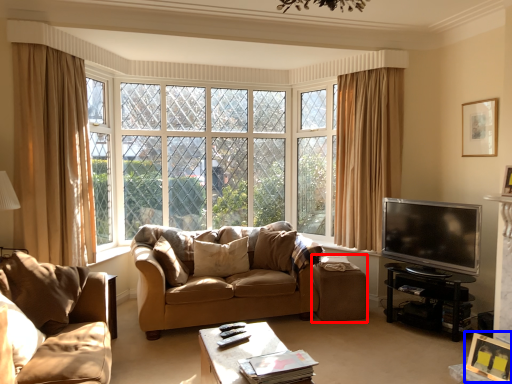
Question: Which object is further to the camera taking this photo, stool (highlighted by a red box) or picture frame (highlighted by a blue box)?

Choices:
 (A) stool
 (B) picture frame

Answer: (A)